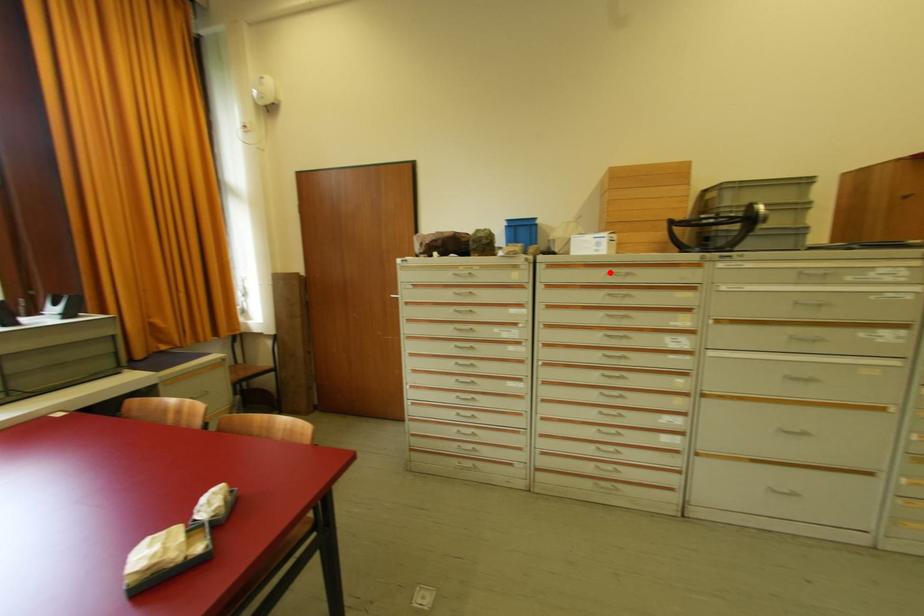
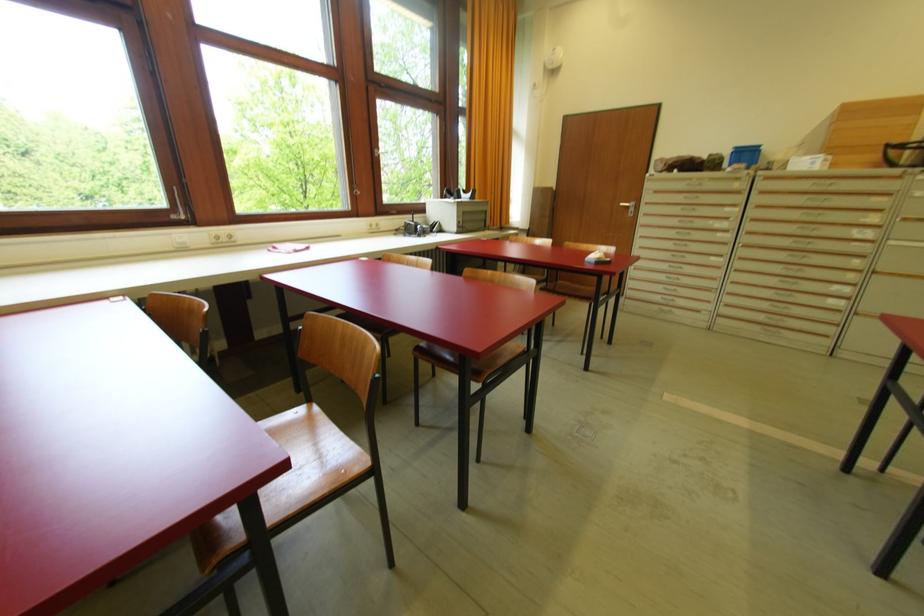
Find the pixel in the second image that matches the highlighted location in the first image.

(817, 183)